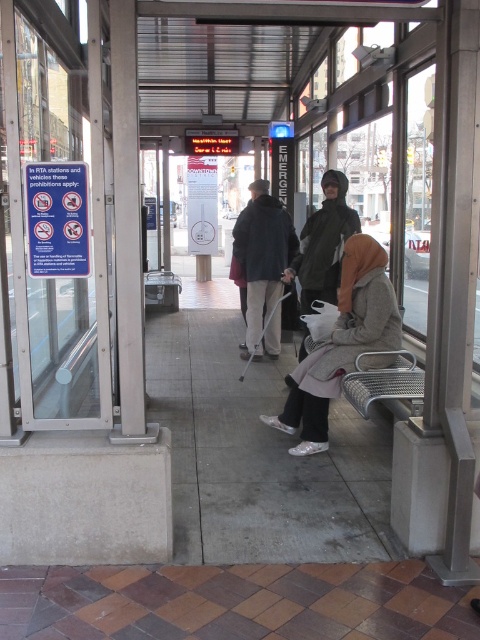
You are a delivery person standing at the entrance of the bus stop shelter. You need to place a package on the ground near the matte gray coat at center without getting it wet. The brown tile pavement at lower center is dry. Where should you place the package?

The brown tile pavement at lower center is positioned under the matte gray coat at center, so placing the package there would keep it dry and close to the matte gray coat at center.

Consider the image. You are a delivery person with a large box that is 2 meters wide. You need to place it on the ground in the bus stop shelter. Can you fit the box on the brown tile pavement at lower center without overlapping the metallic silver bench at lower right?

The brown tile pavement at lower center might be wider than metallic silver bench at lower right, so there is a possibility that the box can fit without overlapping. However, since the exact width difference is uncertain, it is recommended to check the actual space before placing the box.